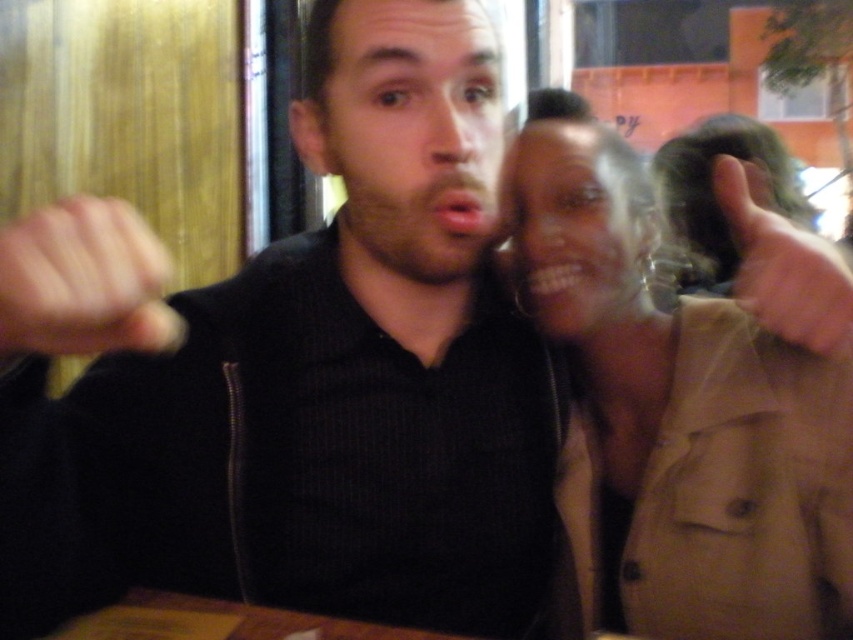
From the picture: Can you confirm if tan fabric jacket at upper right is positioned to the left of matte skin face at upper right?

In fact, tan fabric jacket at upper right is to the right of matte skin face at upper right.

Which is in front, point (846, 275) or point (541, 160)?

Point (846, 275) is in front.

Locate an element on the screen. This screenshot has width=853, height=640. tan fabric jacket at upper right is located at coordinates (683, 401).

Who is positioned more to the left, black matte shirt at center or matte skin face at upper right?

Answer: From the viewer's perspective, black matte shirt at center appears more on the left side.

Locate an element on the screen. Image resolution: width=853 pixels, height=640 pixels. black matte shirt at center is located at coordinates (294, 372).

The width and height of the screenshot is (853, 640). I want to click on black matte shirt at center, so click(x=294, y=372).

Is tan fabric jacket at upper right in front of matte black fist at center?

That is False.

Is point (558, 509) positioned before point (149, 307)?

No.

Who is more forward, (601, 413) or (144, 221)?

Point (601, 413) is in front.

At what (x,y) coordinates should I click in order to perform the action: click on tan fabric jacket at upper right. Please return your answer as a coordinate pair (x, y). Image resolution: width=853 pixels, height=640 pixels. Looking at the image, I should click on (683, 401).